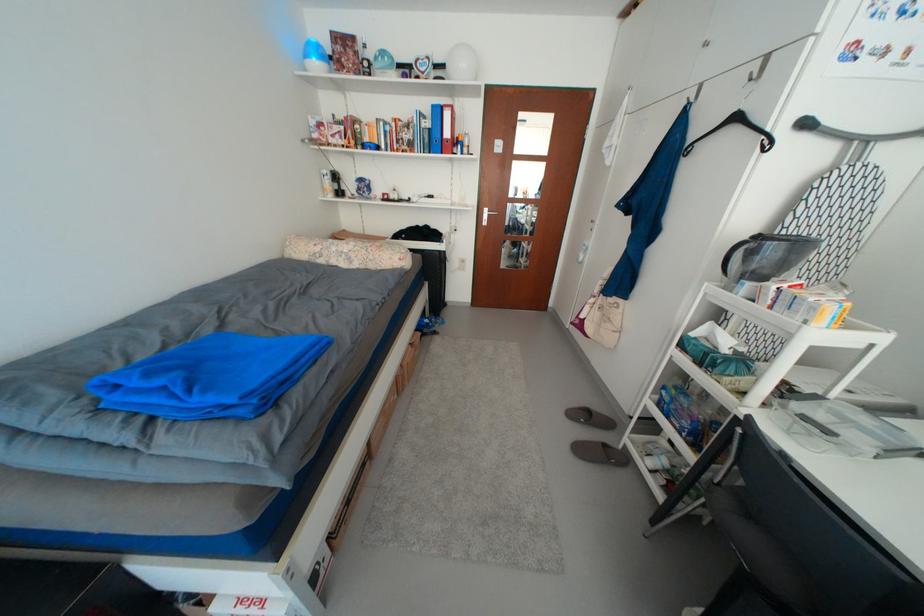
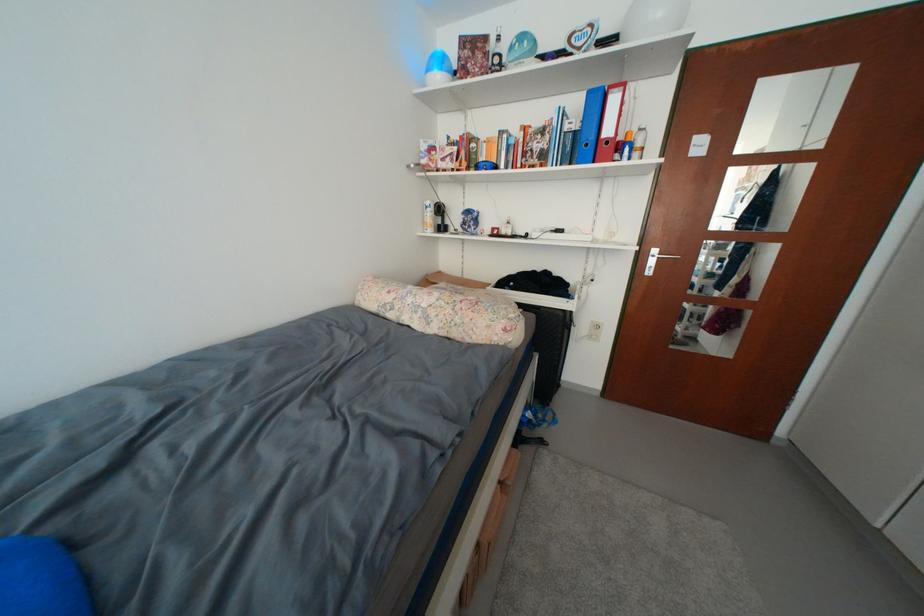
Where in the second image is the point corresponding to the point at 435,143 from the first image?

(578, 151)